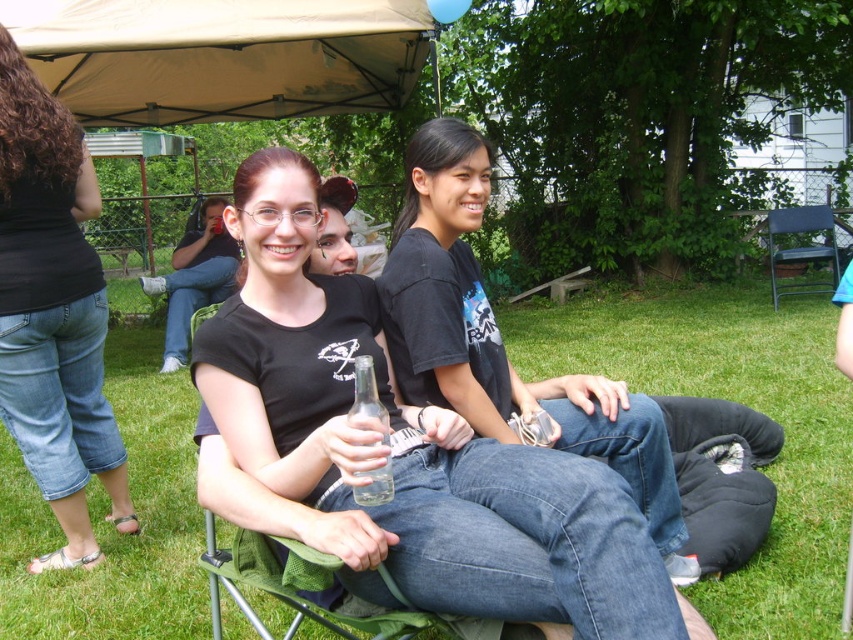
Can you confirm if matte black shirt at center is smaller than clear glass bottle at center?

Actually, matte black shirt at center might be larger than clear glass bottle at center.

Does point (196, 248) come closer to viewer compared to point (352, 492)?

That is False.

Who is more distant from viewer, (x=229, y=243) or (x=376, y=468)?

The point (x=229, y=243) is more distant.

This screenshot has height=640, width=853. I want to click on matte black shirt at center, so click(194, 278).

Does green grass at lower center appear under matte black shirt at center?

Yes, green grass at lower center is below matte black shirt at center.

Measure the distance between green grass at lower center and camera.

green grass at lower center is 7.07 feet away from camera.

Where is `green grass at lower center`? This screenshot has height=640, width=853. green grass at lower center is located at coordinates (740, 401).

Can you confirm if green grass at lower center is taller than black denim jeans at lower left?

In fact, green grass at lower center may be shorter than black denim jeans at lower left.

The image size is (853, 640). What do you see at coordinates (740, 401) in the screenshot?
I see `green grass at lower center` at bounding box center [740, 401].

Who is more distant from viewer, (166,493) or (99,404)?

Positioned behind is point (166,493).

You are a GUI agent. You are given a task and a screenshot of the screen. Output one action in this format:
    pyautogui.click(x=<x>, y=<y>)
    Task: Click on the green grass at lower center
    
    Given the screenshot: What is the action you would take?
    pyautogui.click(x=740, y=401)